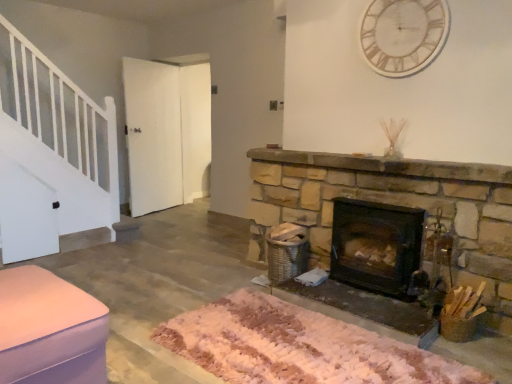
Question: Does white marble clock at upper center contain pink fabric ottoman at lower left?

Choices:
 (A) no
 (B) yes

Answer: (A)

Question: From the image's perspective, would you say white marble clock at upper center is shown under pink fabric ottoman at lower left?

Choices:
 (A) no
 (B) yes

Answer: (A)

Question: From the image's perspective, is white marble clock at upper center over pink fabric ottoman at lower left?

Choices:
 (A) yes
 (B) no

Answer: (A)

Question: Is white marble clock at upper center facing away from pink fabric ottoman at lower left?

Choices:
 (A) no
 (B) yes

Answer: (A)

Question: Does white marble clock at upper center have a greater width compared to pink fabric ottoman at lower left?

Choices:
 (A) no
 (B) yes

Answer: (A)

Question: Is dark brown stone wood burning stove at center right wider or thinner than white fluffy mat at center?

Choices:
 (A) wide
 (B) thin

Answer: (B)

Question: From a real-world perspective, relative to white fluffy mat at center, is dark brown stone wood burning stove at center right vertically above or below?

Choices:
 (A) above
 (B) below

Answer: (A)

Question: Is dark brown stone wood burning stove at center right bigger or smaller than white fluffy mat at center?

Choices:
 (A) small
 (B) big

Answer: (A)

Question: Would you say dark brown stone wood burning stove at center right is inside or outside white fluffy mat at center?

Choices:
 (A) outside
 (B) inside

Answer: (A)

Question: Is pink fabric ottoman at lower left in front of or behind white marble clock at upper center in the image?

Choices:
 (A) behind
 (B) front

Answer: (B)

Question: Looking at their shapes, would you say pink fabric ottoman at lower left is wider or thinner than white marble clock at upper center?

Choices:
 (A) thin
 (B) wide

Answer: (B)

Question: Based on their sizes in the image, would you say pink fabric ottoman at lower left is bigger or smaller than white marble clock at upper center?

Choices:
 (A) big
 (B) small

Answer: (A)

Question: Considering the positions of pink fabric ottoman at lower left and white marble clock at upper center in the image, is pink fabric ottoman at lower left taller or shorter than white marble clock at upper center?

Choices:
 (A) short
 (B) tall

Answer: (A)

Question: Does point (69, 283) appear closer or farther from the camera than point (416, 220)?

Choices:
 (A) farther
 (B) closer

Answer: (B)

Question: Is pink fabric ottoman at lower left taller or shorter than dark brown stone wood burning stove at center right?

Choices:
 (A) short
 (B) tall

Answer: (A)